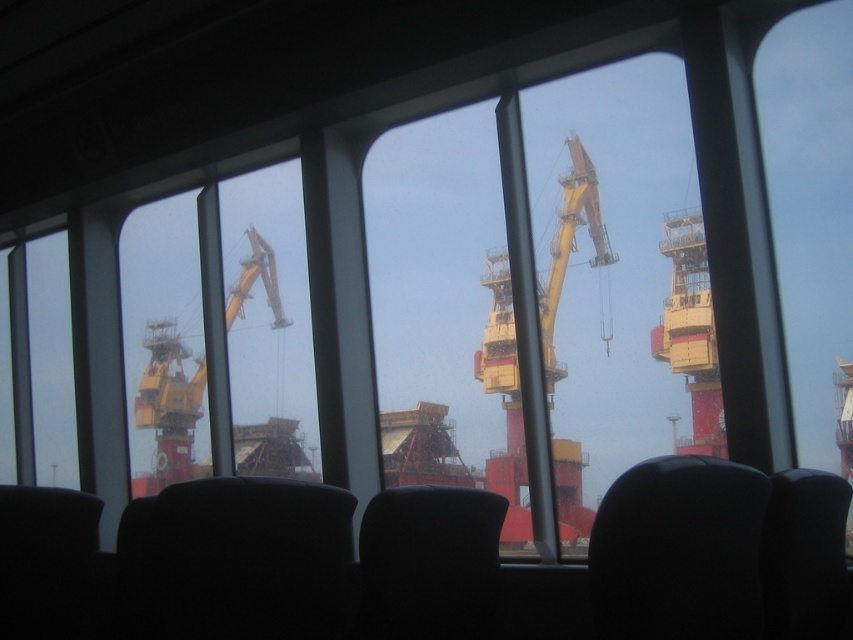
Question: Which of the following is the farthest from the observer?

Choices:
 (A) black leather chair at lower right
 (B) yellow metallic crane at left

Answer: (B)

Question: Can you confirm if black leather chair at lower right is positioned above matte black chair at lower left?

Choices:
 (A) yes
 (B) no

Answer: (A)

Question: Which point is closer to the camera?

Choices:
 (A) (62, 604)
 (B) (805, 500)
 (C) (277, 321)

Answer: (B)

Question: Does black leather chair at lower right appear on the right side of black fabric chair at lower center?

Choices:
 (A) no
 (B) yes

Answer: (B)

Question: Does black fabric chair at center appear on the right side of yellow metallic crane at left?

Choices:
 (A) yes
 (B) no

Answer: (A)

Question: Considering the real-world distances, which object is farthest from the black fabric chair at center?

Choices:
 (A) matte black chair at lower left
 (B) black leather chair at lower right
 (C) black fabric chair at lower center
 (D) yellow metallic crane at center

Answer: (D)